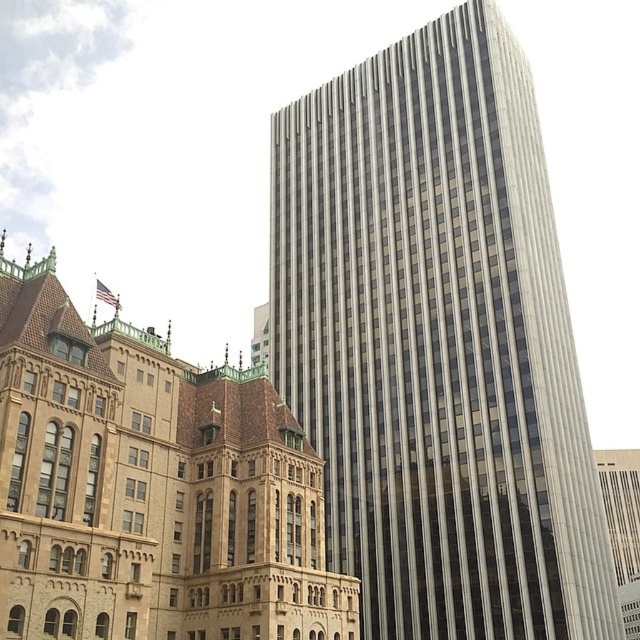
What are the coordinates of the silver glass skyscraper at center?

The silver glass skyscraper at center is located at coordinates point (436, 342).

Please look at the image. There is a point marked at coordinates (x=436, y=342). Which object in the scene does this point correspond to?

The point at coordinates (x=436, y=342) corresponds to the silver glass skyscraper at center.